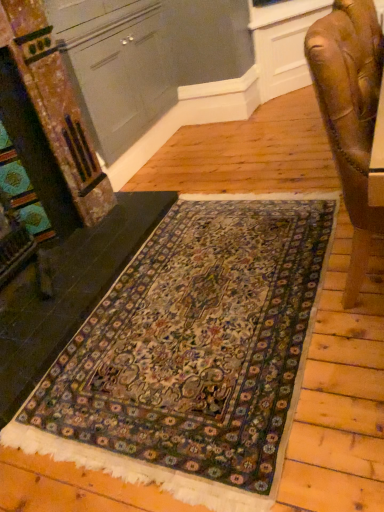
The height and width of the screenshot is (512, 384). Identify the location of matte gray cabinet at upper left. (116, 67).

Is carpeted rug at center positioned far away from carpet at lower left?

No, carpeted rug at center is not far away from carpet at lower left.

How much distance is there between carpeted rug at center and carpet at lower left?

They are 15.40 inches apart.

Is carpeted rug at center facing towards carpet at lower left?

No.

Is point (181, 399) positioned in front of point (107, 264)?

Yes, point (181, 399) is closer to viewer.

Which of these two, carpet at lower left or matte gray cabinet at upper left, is smaller?

Smaller between the two is carpet at lower left.

Looking at this image, in the image, is carpet at lower left on the left side or the right side of matte gray cabinet at upper left?

carpet at lower left is positioned on matte gray cabinet at upper left's left side.

Could you tell me if carpet at lower left is facing matte gray cabinet at upper left?

No, carpet at lower left is not facing towards matte gray cabinet at upper left.

Between carpet at lower left and matte gray cabinet at upper left, which one has more height?

matte gray cabinet at upper left.

How different are the orientations of matte gray cabinet at upper left and wooden carved chair at right in degrees?

They differ by 0.449 degrees in their facing directions.

Between matte gray cabinet at upper left and wooden carved chair at right, which one has larger width?

Wider between the two is matte gray cabinet at upper left.

From a real-world perspective, is matte gray cabinet at upper left on wooden carved chair at right?

Correct, in the physical world, matte gray cabinet at upper left is higher than wooden carved chair at right.

Considering the points (146, 112) and (370, 220), which point is behind, point (146, 112) or point (370, 220)?

The point (146, 112) is more distant.

From a real-world perspective, is wooden carved chair at right physically above carpet at lower left?

Yes, from a real-world perspective, wooden carved chair at right is over carpet at lower left

How different are the orientations of wooden carved chair at right and carpet at lower left in degrees?

They differ by 0.871 degrees in their facing directions.

Is wooden carved chair at right located outside carpet at lower left?

Yes.

Based on the photo, is wooden carved chair at right next to carpet at lower left?

wooden carved chair at right and carpet at lower left are clearly separated.

How many degrees apart are the facing directions of matte gray cabinet at upper left and carpet at lower left?

matte gray cabinet at upper left and carpet at lower left are facing 0.422 degrees away from each other.

From the image's perspective, is matte gray cabinet at upper left located above or below carpet at lower left?

matte gray cabinet at upper left is situated higher than carpet at lower left in the image.

This screenshot has width=384, height=512. What are the coordinates of `cabinetry on the right side of carpet at lower left` in the screenshot? It's located at (116, 67).

Considering the sizes of objects matte gray cabinet at upper left and carpet at lower left in the image provided, who is bigger, matte gray cabinet at upper left or carpet at lower left?

matte gray cabinet at upper left is bigger.

Locate an element on the screen. This screenshot has width=384, height=512. stair lying on the left of carpeted rug at center is located at coordinates point(68,292).

Is carpet at lower left facing away from carpeted rug at center?

carpet at lower left is not turned away from carpeted rug at center.

In the image, is carpet at lower left positioned in front of or behind carpeted rug at center?

carpet at lower left is positioned farther from the viewer than carpeted rug at center.

Is carpet at lower left not near carpeted rug at center?

No, carpet at lower left is not far away from carpeted rug at center.

Can you confirm if carpeted rug at center is smaller than matte gray cabinet at upper left?

Yes.

Which of these two, carpeted rug at center or matte gray cabinet at upper left, stands shorter?

Standing shorter between the two is carpeted rug at center.

Between carpeted rug at center and matte gray cabinet at upper left, which one has larger width?

carpeted rug at center.

Find the location of a particular element. mat that is below the carpet at lower left (from the image's perspective) is located at coordinates (193, 353).

At what (x,y) coordinates should I click in order to perform the action: click on stair below the matte gray cabinet at upper left (from a real-world perspective). Please return your answer as a coordinate pair (x, y). Looking at the image, I should click on (68, 292).

Looking at the image, which one is located closer to carpeted rug at center, wooden carved chair at right or matte gray cabinet at upper left?

wooden carved chair at right is positioned closer to the anchor carpeted rug at center.

Based on their spatial positions, is carpeted rug at center or carpet at lower left further from matte gray cabinet at upper left?

The object further to matte gray cabinet at upper left is carpeted rug at center.

Looking at the image, which one is located further to carpet at lower left, matte gray cabinet at upper left or wooden carved chair at right?

wooden carved chair at right lies further to carpet at lower left than the other object.

When comparing their distances from carpet at lower left, does wooden carved chair at right or matte gray cabinet at upper left seem further?

The object further to carpet at lower left is wooden carved chair at right.

From the image, which object appears to be farther from carpeted rug at center, matte gray cabinet at upper left or wooden carved chair at right?

matte gray cabinet at upper left lies further to carpeted rug at center than the other object.

Which object lies further to the anchor point carpeted rug at center, wooden carved chair at right or carpet at lower left?

Based on the image, wooden carved chair at right appears to be further to carpeted rug at center.

When comparing their distances from carpet at lower left, does matte gray cabinet at upper left or carpeted rug at center seem further?

The object further to carpet at lower left is matte gray cabinet at upper left.

Considering their positions, is carpet at lower left positioned further to carpeted rug at center than wooden carved chair at right?

wooden carved chair at right lies further to carpeted rug at center than the other object.

Locate an element on the screen. mat between carpet at lower left and wooden carved chair at right in the horizontal direction is located at coordinates (193, 353).

Locate an element on the screen. The image size is (384, 512). chair between matte gray cabinet at upper left and carpet at lower left from top to bottom is located at coordinates (350, 114).

Locate an element on the screen. This screenshot has height=512, width=384. chair between matte gray cabinet at upper left and carpeted rug at center from top to bottom is located at coordinates (350, 114).

Find the location of a particular element. The image size is (384, 512). stair between matte gray cabinet at upper left and carpeted rug at center vertically is located at coordinates (68, 292).